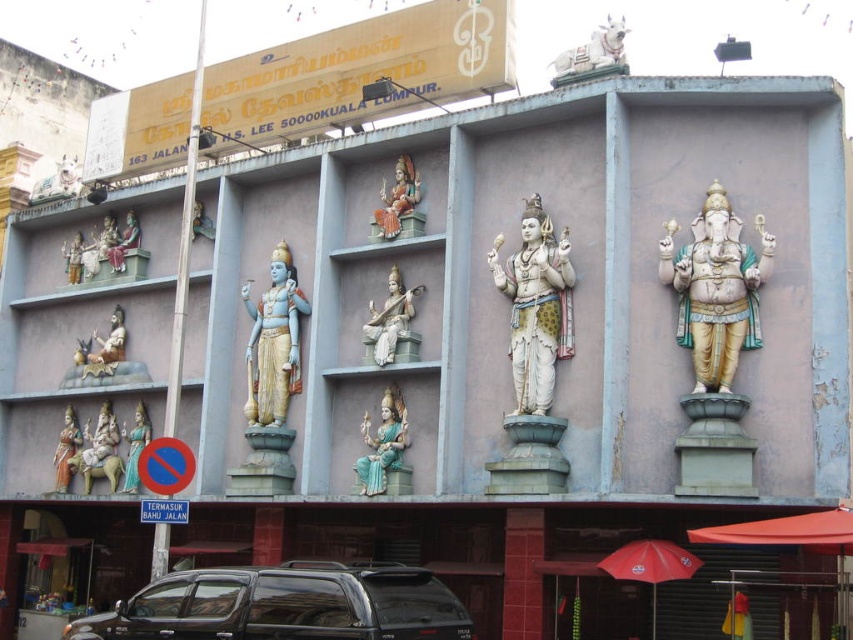
The height and width of the screenshot is (640, 853). I want to click on white marble statue at center, so click(537, 307).

Can you confirm if white marble statue at center is smaller than teal glossy statue at center?

Indeed, white marble statue at center has a smaller size compared to teal glossy statue at center.

Who is more distant from viewer, (541, 262) or (136, 444)?

Positioned behind is point (136, 444).

The height and width of the screenshot is (640, 853). Find the location of `white marble statue at center`. white marble statue at center is located at coordinates (537, 307).

Is polished gold statue at right shorter than white marble bull at upper center?

Indeed, polished gold statue at right has a lesser height compared to white marble bull at upper center.

Can you confirm if polished gold statue at right is positioned to the left of white marble bull at upper center?

Incorrect, polished gold statue at right is not on the left side of white marble bull at upper center.

This screenshot has height=640, width=853. Identify the location of polished gold statue at right. (717, 289).

Between black matte suv at lower center and matte white statue at center, which one has more height?

black matte suv at lower center is taller.

Locate an element on the screen. black matte suv at lower center is located at coordinates (285, 605).